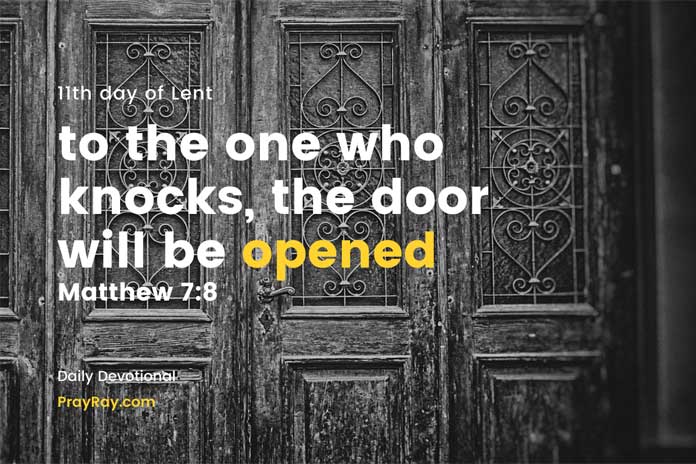
Where is `top pieces of moulding`? This screenshot has width=696, height=464. top pieces of moulding is located at coordinates (1, 21), (148, 20), (363, 23), (530, 15), (120, 363), (351, 358), (1, 358), (532, 353).